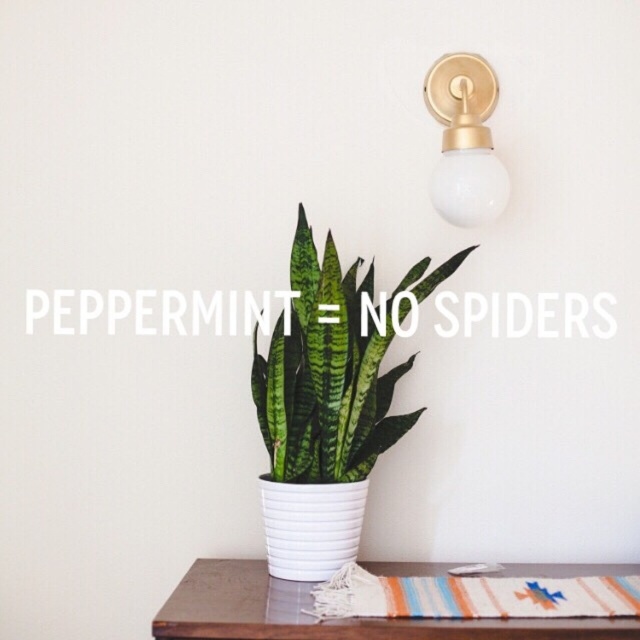
Find the location of `green glossy snake plant at center`. green glossy snake plant at center is located at coordinates (332, 368).

Looking at this image, can you confirm if green glossy snake plant at center is positioned below gold/brass/textured wall sconce at upper right?

Yes, green glossy snake plant at center is below gold/brass/textured wall sconce at upper right.

Between point (268, 392) and point (440, 170), which one is positioned in front?

Point (268, 392)

Locate an element on the screen. Image resolution: width=640 pixels, height=640 pixels. green glossy snake plant at center is located at coordinates pyautogui.click(x=332, y=368).

Does brown wooden table at lower center have a smaller size compared to gold/brass/textured wall sconce at upper right?

No, brown wooden table at lower center is not smaller than gold/brass/textured wall sconce at upper right.

Is point (477, 625) more distant than point (429, 108)?

That is False.

Locate an element on the screen. The width and height of the screenshot is (640, 640). brown wooden table at lower center is located at coordinates (333, 621).

Is green glossy snake plant at center shorter than brown wooden table at lower center?

Incorrect, green glossy snake plant at center's height does not fall short of brown wooden table at lower center's.

Can you confirm if green glossy snake plant at center is wider than brown wooden table at lower center?

No, green glossy snake plant at center is not wider than brown wooden table at lower center.

Does point (280, 390) lie behind point (378, 566)?

No, it is not.

Where is `green glossy snake plant at center`? The height and width of the screenshot is (640, 640). green glossy snake plant at center is located at coordinates (332, 368).